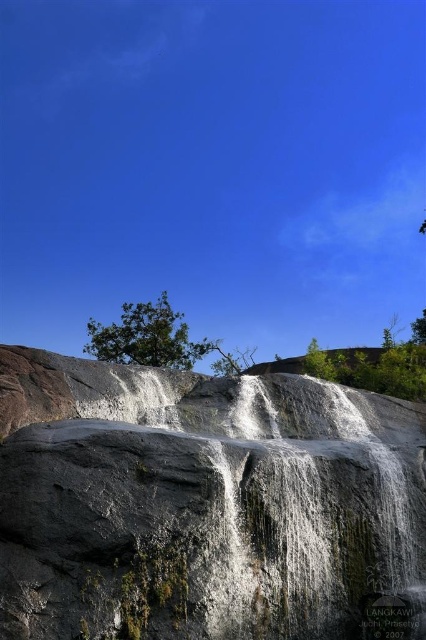
Question: Which point is closer to the camera?

Choices:
 (A) (91, 348)
 (B) (166, 618)

Answer: (B)

Question: Is gray rough rock face at center further to camera compared to green leafy tree at center?

Choices:
 (A) no
 (B) yes

Answer: (A)

Question: Considering the relative positions of gray rough rock face at center and green leafy tree at center in the image provided, where is gray rough rock face at center located with respect to green leafy tree at center?

Choices:
 (A) left
 (B) right

Answer: (B)

Question: Can you confirm if gray rough rock face at center is positioned above green leafy tree at center?

Choices:
 (A) no
 (B) yes

Answer: (A)